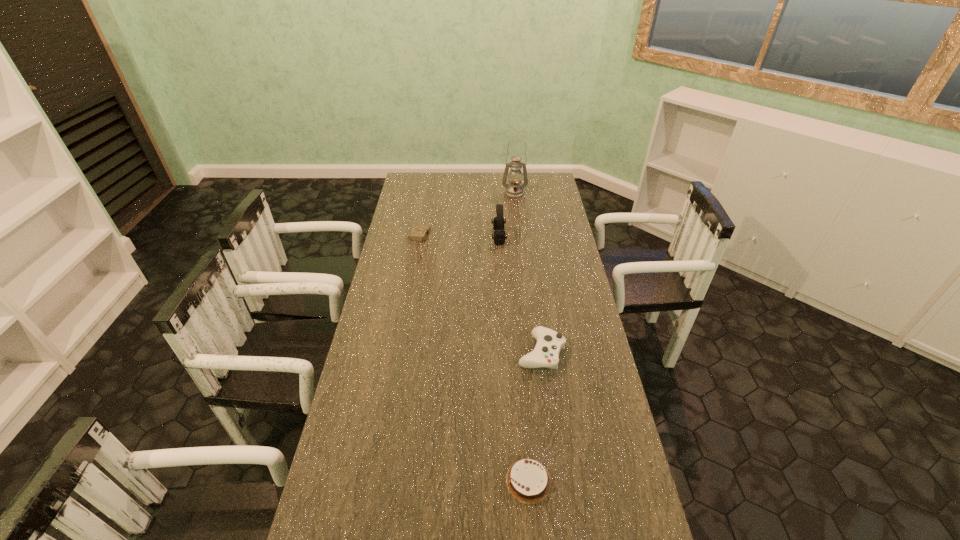
Locate an element on the screen. The width and height of the screenshot is (960, 540). oil lamp is located at coordinates (514, 190).

You are a GUI agent. You are given a task and a screenshot of the screen. Output one action in this format:
    pyautogui.click(x=<x>, y=<y>)
    Task: Click on the tallest object
    This screenshot has width=960, height=540.
    Given the screenshot: What is the action you would take?
    pyautogui.click(x=514, y=190)

Where is `the second tallest object`? the second tallest object is located at coordinates (498, 222).

Where is `control`? control is located at coordinates (549, 343).

I want to click on the third shortest object, so click(x=549, y=343).

You are a GUI agent. You are given a task and a screenshot of the screen. Output one action in this format:
    pyautogui.click(x=<x>, y=<y>)
    Task: Click on the diary
    
    Given the screenshot: What is the action you would take?
    pyautogui.click(x=419, y=232)

Where is `the nearest object`? Image resolution: width=960 pixels, height=540 pixels. the nearest object is located at coordinates (528, 480).

This screenshot has width=960, height=540. I want to click on vacant area situated 0.200m on the left of the farthest object, so click(x=463, y=193).

Image resolution: width=960 pixels, height=540 pixels. Identify the location of free space located on the headband of the headset. point(421,237).

This screenshot has height=540, width=960. Identify the location of vacant region located on the headband of the headset. (421, 237).